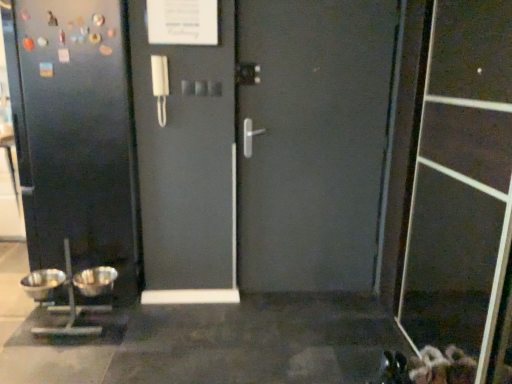
Question: Considering the relative sizes of silver metallic bowls at lower left and transparent plastic screen door at lower right in the image provided, is silver metallic bowls at lower left bigger than transparent plastic screen door at lower right?

Choices:
 (A) no
 (B) yes

Answer: (A)

Question: Is silver metallic bowls at lower left facing away from transparent plastic screen door at lower right?

Choices:
 (A) yes
 (B) no

Answer: (B)

Question: Can you confirm if silver metallic bowls at lower left is wider than transparent plastic screen door at lower right?

Choices:
 (A) no
 (B) yes

Answer: (B)

Question: Does silver metallic bowls at lower left have a lesser height compared to transparent plastic screen door at lower right?

Choices:
 (A) no
 (B) yes

Answer: (B)

Question: Is silver metallic bowls at lower left further to camera compared to transparent plastic screen door at lower right?

Choices:
 (A) yes
 (B) no

Answer: (A)

Question: Considering the positions of metallic gray door at center and transparent plastic screen door at lower right in the image, is metallic gray door at center taller or shorter than transparent plastic screen door at lower right?

Choices:
 (A) short
 (B) tall

Answer: (B)

Question: Which is correct: metallic gray door at center is inside transparent plastic screen door at lower right, or outside of it?

Choices:
 (A) inside
 (B) outside

Answer: (B)

Question: Visually, is metallic gray door at center positioned to the left or to the right of transparent plastic screen door at lower right?

Choices:
 (A) left
 (B) right

Answer: (A)

Question: Considering the positions of metallic gray door at center and transparent plastic screen door at lower right in the image, is metallic gray door at center bigger or smaller than transparent plastic screen door at lower right?

Choices:
 (A) big
 (B) small

Answer: (A)

Question: Would you say silver metallic mixing bowl at lower left, marked as the 1th mixing bowl in a right-to-left arrangement, is inside or outside metallic gray door at center?

Choices:
 (A) inside
 (B) outside

Answer: (B)

Question: Is silver metallic mixing bowl at lower left, marked as the second mixing bowl in a left-to-right arrangement, taller or shorter than metallic gray door at center?

Choices:
 (A) short
 (B) tall

Answer: (A)

Question: Relative to metallic gray door at center, is silver metallic mixing bowl at lower left, marked as the 1th mixing bowl in a right-to-left arrangement, in front or behind?

Choices:
 (A) behind
 (B) front

Answer: (A)

Question: Considering the positions of silver metallic mixing bowl at lower left, marked as the 1th mixing bowl in a right-to-left arrangement, and metallic gray door at center in the image, is silver metallic mixing bowl at lower left, marked as the 1th mixing bowl in a right-to-left arrangement, wider or thinner than metallic gray door at center?

Choices:
 (A) wide
 (B) thin

Answer: (B)

Question: In terms of height, does silver metallic bowls at lower left look taller or shorter compared to transparent plastic screen door at lower right?

Choices:
 (A) short
 (B) tall

Answer: (A)

Question: Relative to transparent plastic screen door at lower right, is silver metallic bowls at lower left in front or behind?

Choices:
 (A) front
 (B) behind

Answer: (B)